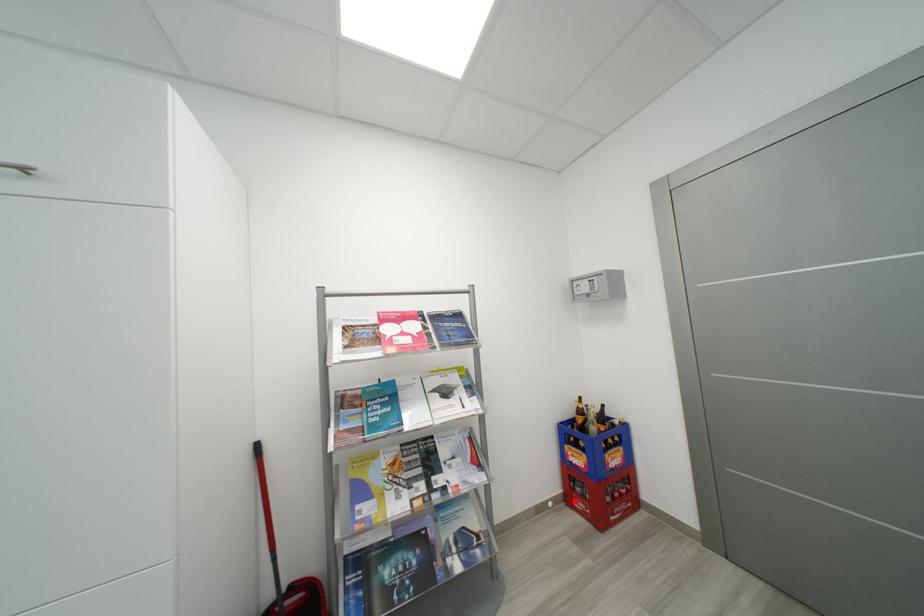
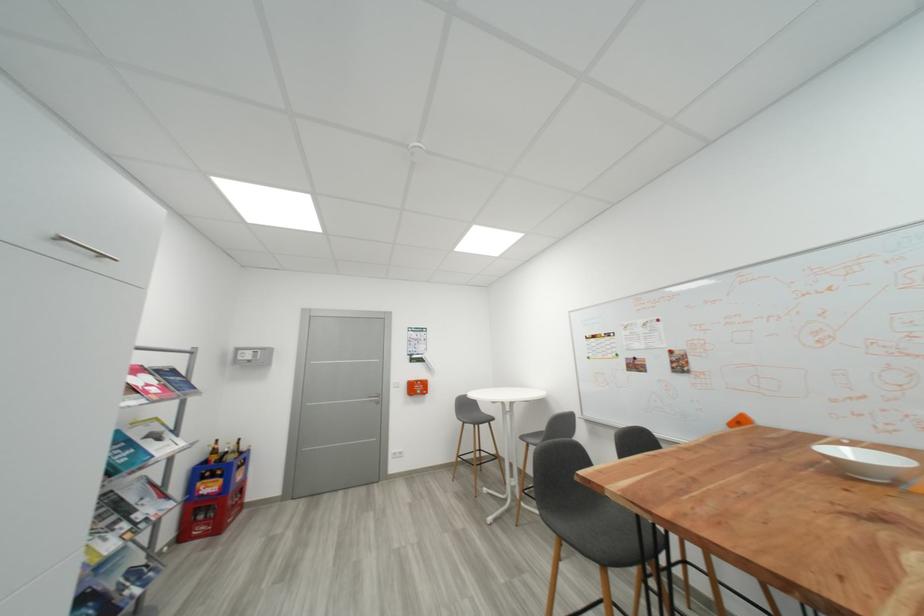
The point at the highlighted location is marked in the first image. Where is the corresponding point in the second image?

(189, 538)